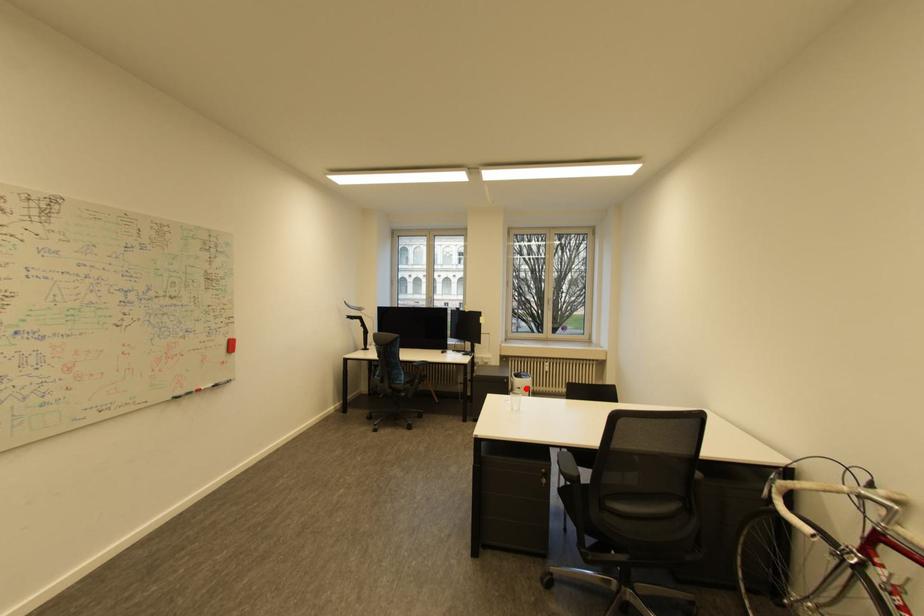
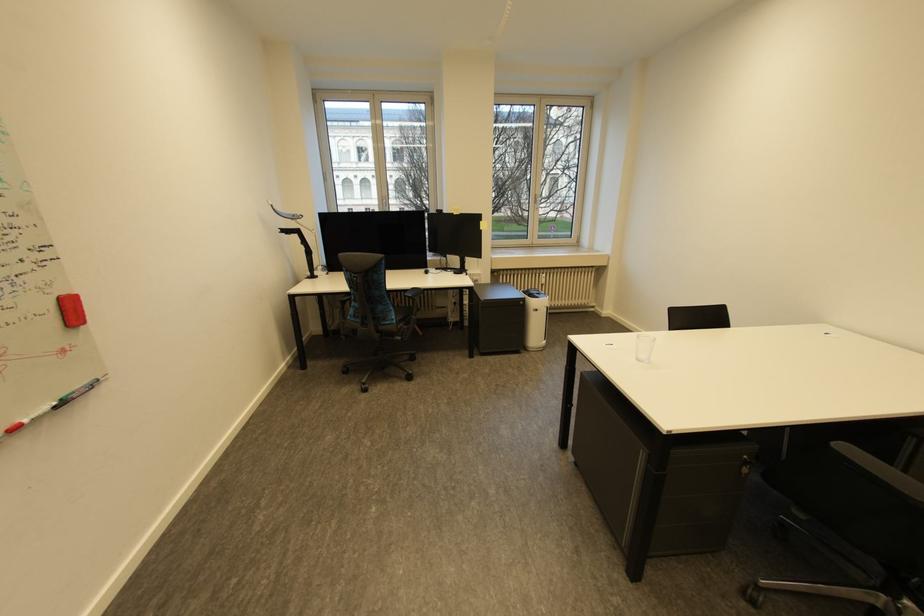
Question: I am providing you with two images of the same scene from different viewpoints. Image1 has a red point marked. In image2, the corresponding 3D location appears at what relative position? Reply with the corresponding letter.

Choices:
 (A) Closer
 (B) Farther

Answer: (A)